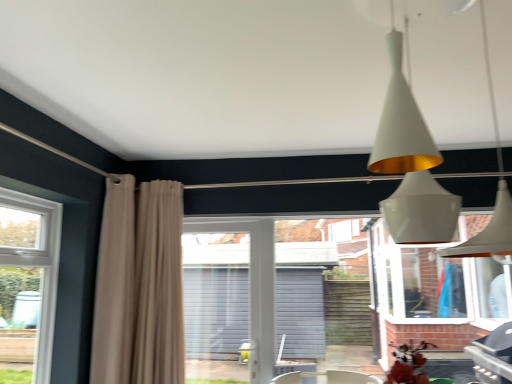
Question: Does beige fabric curtain at left, placed as the 2th curtain when sorted from left to right, have a smaller size compared to white matte cone at upper center?

Choices:
 (A) yes
 (B) no

Answer: (A)

Question: Considering the relative sizes of beige fabric curtain at left, placed as the 2th curtain when sorted from left to right, and white matte cone at upper center in the image provided, is beige fabric curtain at left, placed as the 2th curtain when sorted from left to right, bigger than white matte cone at upper center?

Choices:
 (A) no
 (B) yes

Answer: (A)

Question: Is beige fabric curtain at left, which appears as the first curtain when viewed from the right, closer to the viewer compared to white matte cone at upper center?

Choices:
 (A) yes
 (B) no

Answer: (B)

Question: Is beige fabric curtain at left, placed as the 2th curtain when sorted from left to right, facing away from white matte cone at upper center?

Choices:
 (A) no
 (B) yes

Answer: (A)

Question: Is beige fabric curtain at left, placed as the 2th curtain when sorted from left to right, wider than white matte cone at upper center?

Choices:
 (A) no
 (B) yes

Answer: (A)

Question: Is beige fabric curtain at left, placed as the 2th curtain when sorted from left to right, aimed at white matte cone at upper center?

Choices:
 (A) yes
 (B) no

Answer: (B)

Question: Can we say brick wall at center lies outside beige fabric curtain at left, which ranks as the second curtain in right-to-left order?

Choices:
 (A) yes
 (B) no

Answer: (A)

Question: Is brick wall at center far from beige fabric curtain at left, which ranks as the second curtain in right-to-left order?

Choices:
 (A) no
 (B) yes

Answer: (B)

Question: Could beige fabric curtain at left, which ranks as the second curtain in right-to-left order, be considered to be inside brick wall at center?

Choices:
 (A) yes
 (B) no

Answer: (B)

Question: Does brick wall at center lie in front of beige fabric curtain at left, positioned as the first curtain in left-to-right order?

Choices:
 (A) no
 (B) yes

Answer: (A)

Question: Is brick wall at center turned away from beige fabric curtain at left, which ranks as the second curtain in right-to-left order?

Choices:
 (A) yes
 (B) no

Answer: (B)

Question: Does brick wall at center have a greater width compared to beige fabric curtain at left, which ranks as the second curtain in right-to-left order?

Choices:
 (A) no
 (B) yes

Answer: (A)

Question: Can you confirm if white matte cone at upper center is smaller than brick wall at center?

Choices:
 (A) yes
 (B) no

Answer: (B)